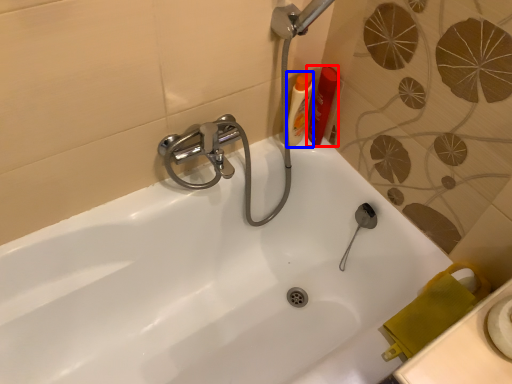
Question: Which object is further to the camera taking this photo, toiletry (highlighted by a red box) or toiletry (highlighted by a blue box)?

Choices:
 (A) toiletry
 (B) toiletry

Answer: (A)